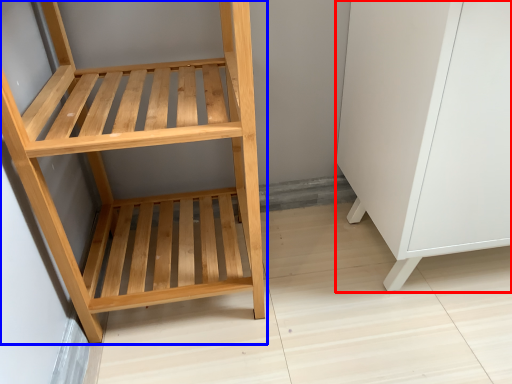
Question: Which object appears farthest to the camera in this image, file cabinet (highlighted by a red box) or furniture (highlighted by a blue box)?

Choices:
 (A) file cabinet
 (B) furniture

Answer: (A)